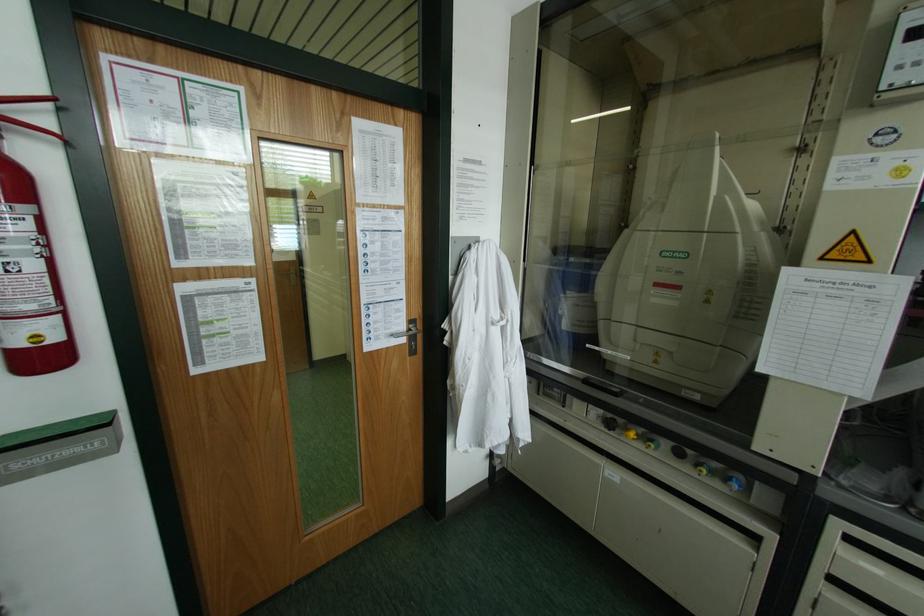
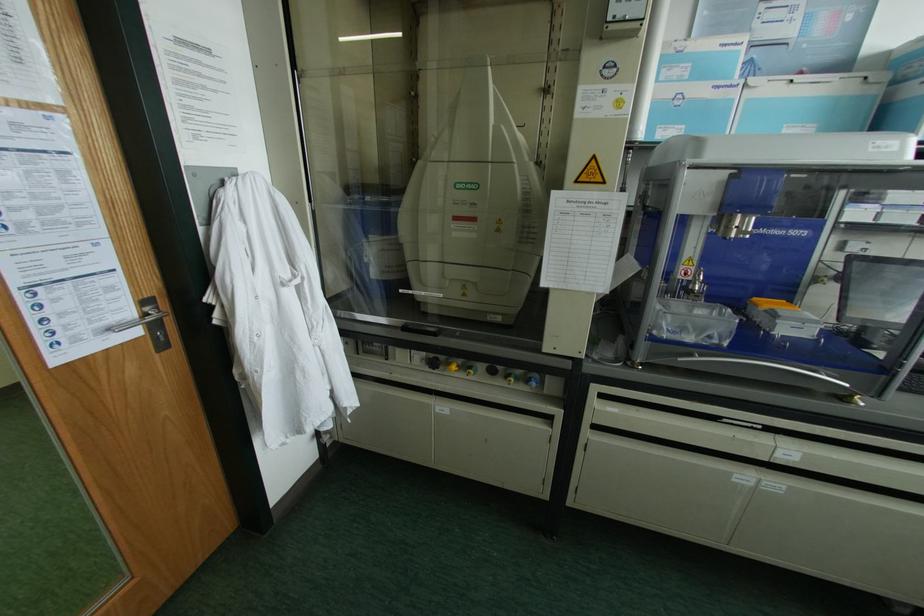
Question: The first image is from the beginning of the video and the second image is from the end. How did the camera likely rotate when shooting the video?

Choices:
 (A) Left
 (B) Right
 (C) Up
 (D) Down

Answer: (B)